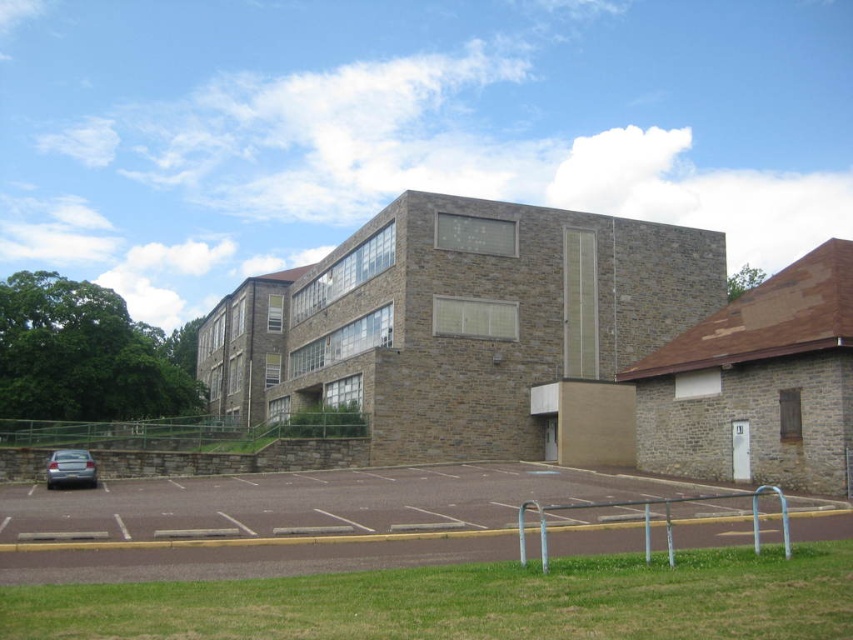
You are driving a car and want to park in the parking lot shown in the image. The parking lot has white lines indicating parking spaces. Your car is currently at the satin silver sedan at lower left. To reach the brown asphalt parking lot at lower center, should you move to your right or left?

The brown asphalt parking lot at lower center is positioned on the right side of the satin silver sedan at lower left, so you should move to your right to reach it.